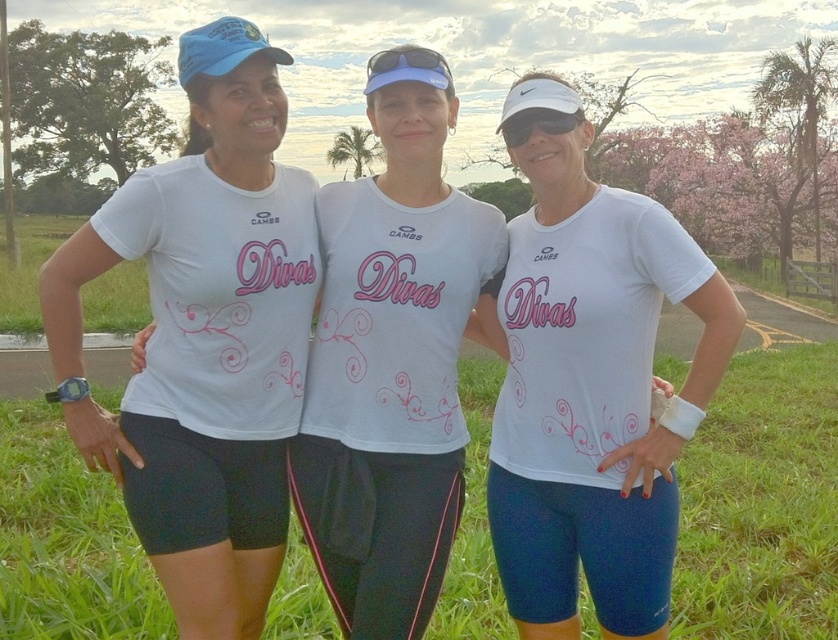
Can you confirm if white matte t-shirt at left is shorter than white matte t-shirt at center?

In fact, white matte t-shirt at left may be taller than white matte t-shirt at center.

Which is in front, point (226, 582) or point (647, 576)?

Point (226, 582)

Where is `white matte t-shirt at left`? white matte t-shirt at left is located at coordinates [x=204, y=337].